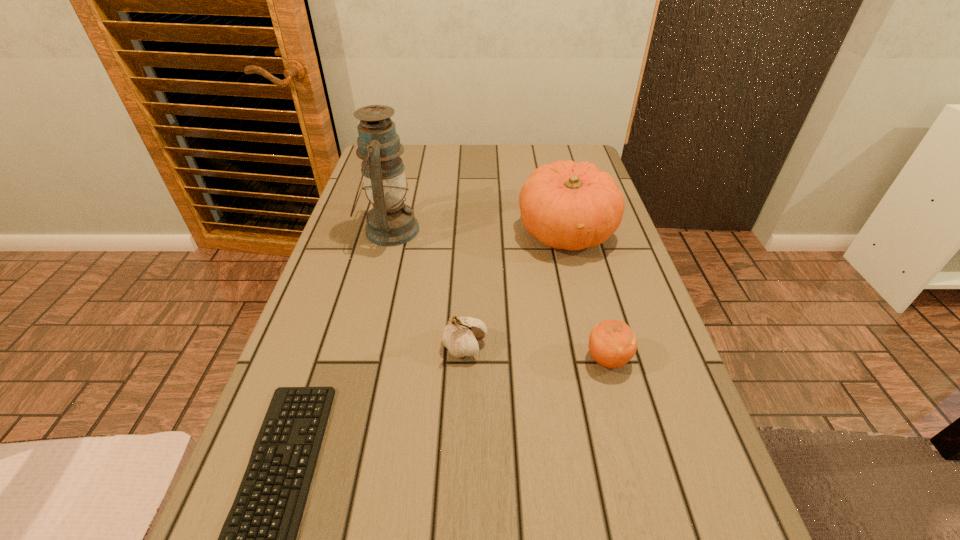
At what (x,y) coordinates should I click in order to perform the action: click on orange that is at the right edge. Please return your answer as a coordinate pair (x, y). This screenshot has width=960, height=540. Looking at the image, I should click on coord(612,344).

Image resolution: width=960 pixels, height=540 pixels. I want to click on free spot at the far edge of the desktop, so click(507, 160).

Where is `free space at the left edge of the desktop`? free space at the left edge of the desktop is located at coordinates (320, 284).

I want to click on free space at the right edge of the desktop, so click(652, 325).

You are a GUI agent. You are given a task and a screenshot of the screen. Output one action in this format:
    pyautogui.click(x=<x>, y=<y>)
    Task: Click on the free point at the far left corner
    
    Given the screenshot: What is the action you would take?
    pyautogui.click(x=415, y=159)

I want to click on free spot at the far right corner of the desktop, so click(x=585, y=152).

Where is `free space between the orange and the garlic`? free space between the orange and the garlic is located at coordinates (537, 353).

Where is `free space between the orange and the second tallest object`? The width and height of the screenshot is (960, 540). free space between the orange and the second tallest object is located at coordinates tap(587, 296).

At what (x,y) coordinates should I click in order to perform the action: click on vacant area that lies between the third object from right to left and the orange. Please return your answer as a coordinate pair (x, y). Looking at the image, I should click on click(537, 353).

The height and width of the screenshot is (540, 960). I want to click on free point between the oil lamp and the fourth shortest object, so click(478, 231).